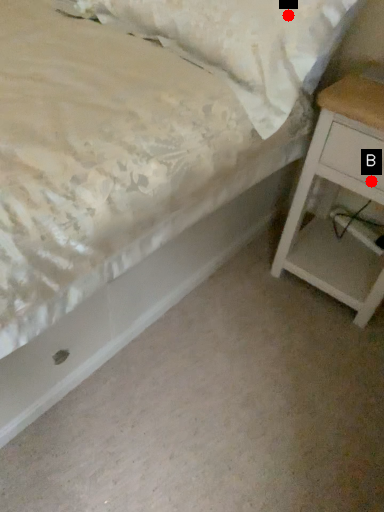
Question: Two points are circled on the image, labeled by A and B beside each circle. Which point appears farthest from the camera in this image?

Choices:
 (A) A is further
 (B) B is further

Answer: (B)